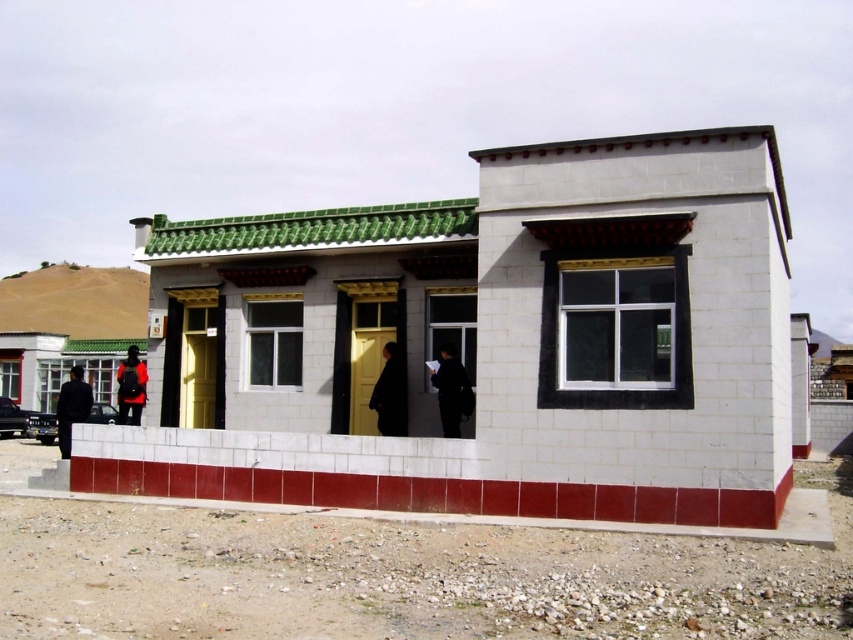
You are standing at the entrance of the building and notice two points marked on the ground. The first point is labeled as point (451, 353) and the second is point (84, 410). Which point is closer to you as you face the building?

Point (451, 353) is closer to you because it is in front of point (84, 410).

In the scene shown: You are standing in front of the building and want to know how far the point at coordinates (457,392) is from you. Can you determine the distance?

The point at coordinates (457,392) is 40.74 feet away from the viewer.

You are standing in front of the building and notice two jackets hanging on a rack near the entrance. The jackets are the black matte jacket at center and the dark blue fabric jacket at left. Which jacket is covering part of the other?

The black matte jacket at center is positioned over the dark blue fabric jacket at left, so it is covering part of the dark blue fabric jacket at left.